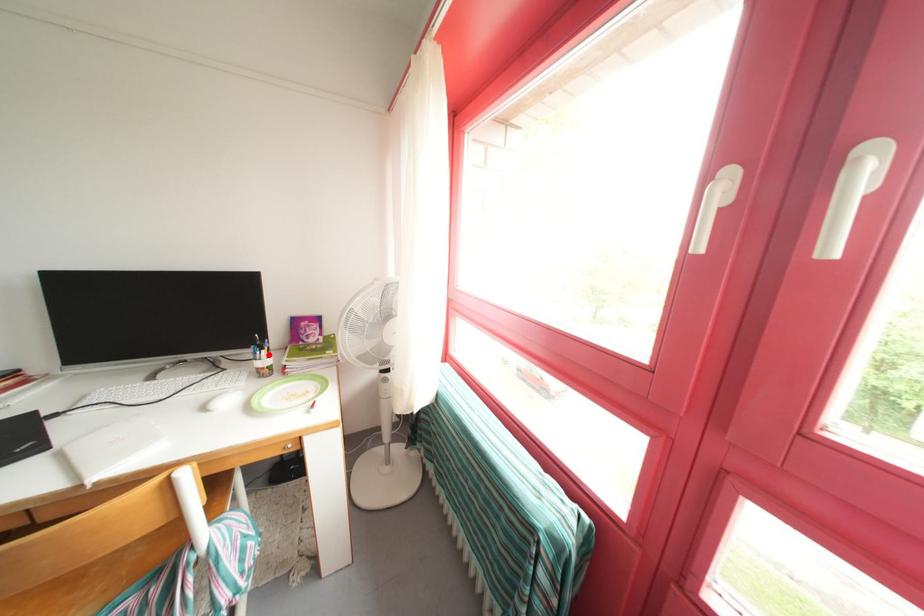
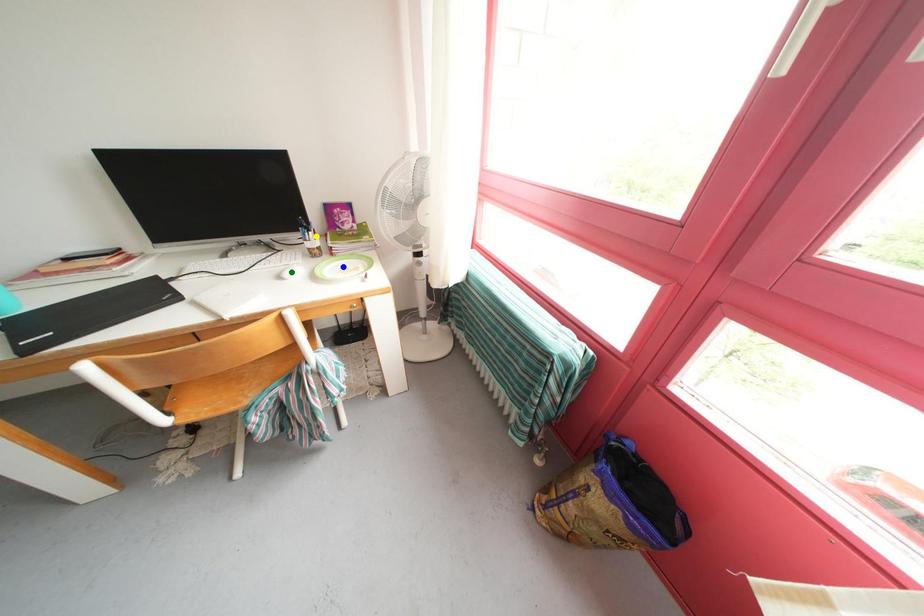
Question: I am providing you with two images of the same scene from different viewpoints. A red point is marked on the first image. You are given multiple points on the second image. Which point in image 2 represents the same 3d spot as the red point in image 1?

Choices:
 (A) yellow point
 (B) blue point
 (C) green point

Answer: (A)